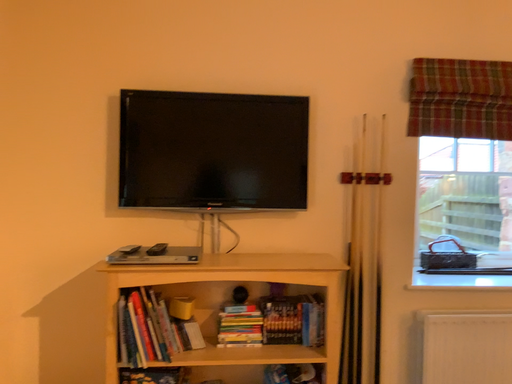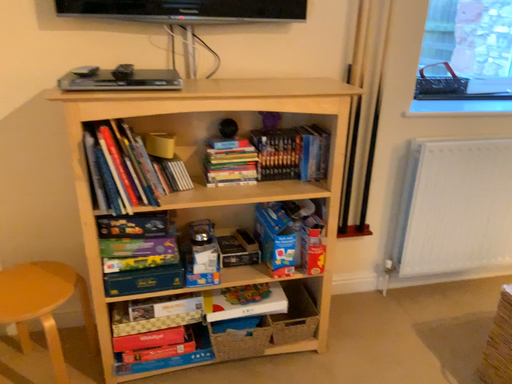
Question: How did the camera likely rotate when shooting the video?

Choices:
 (A) rotated right
 (B) rotated left

Answer: (A)